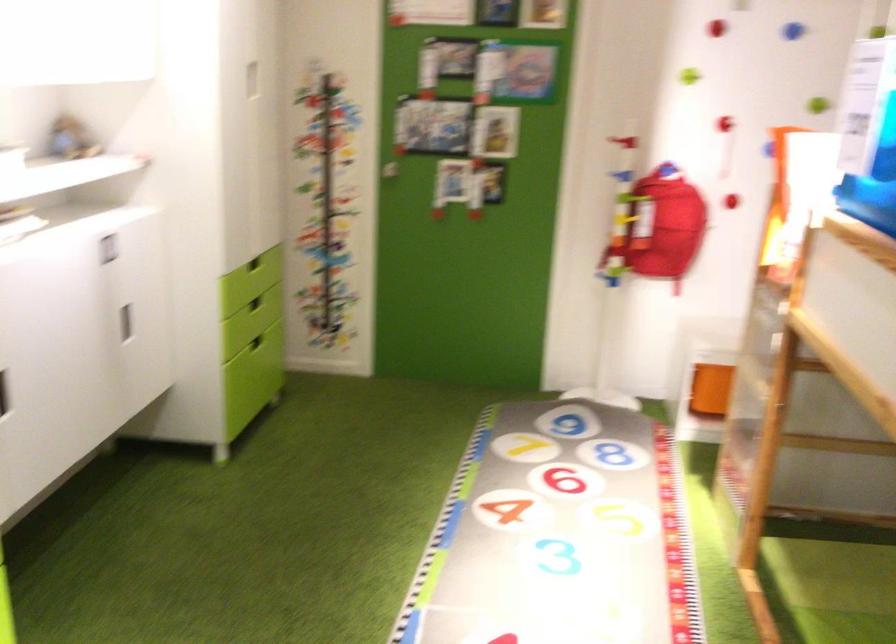
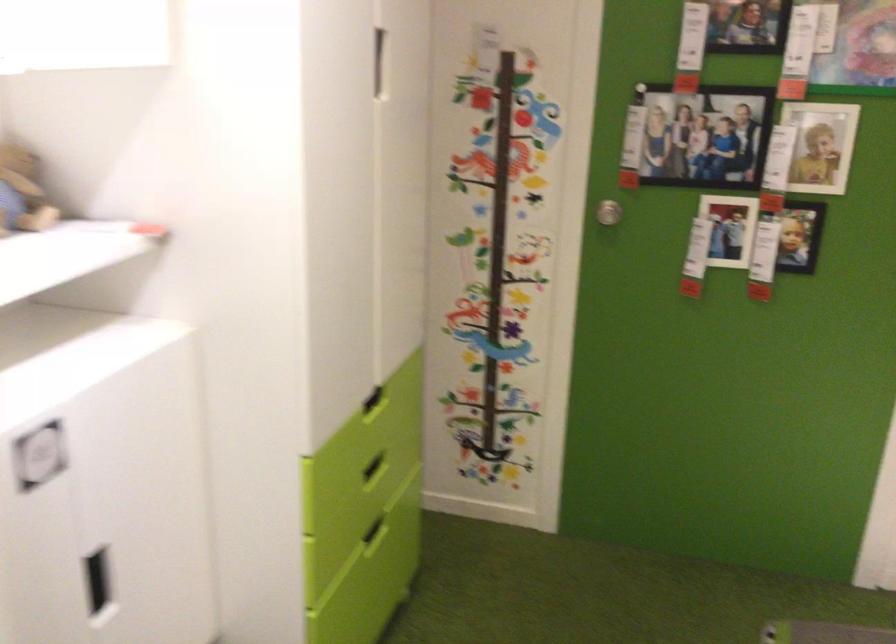
Question: I am providing you with two images of the same scene from different viewpoints. Which of the following objects are not visible in image2?

Choices:
 (A) white cabinet handle
 (B) green drawer handle
 (C) silver door knob
 (D) wooden speaker

Answer: (B)